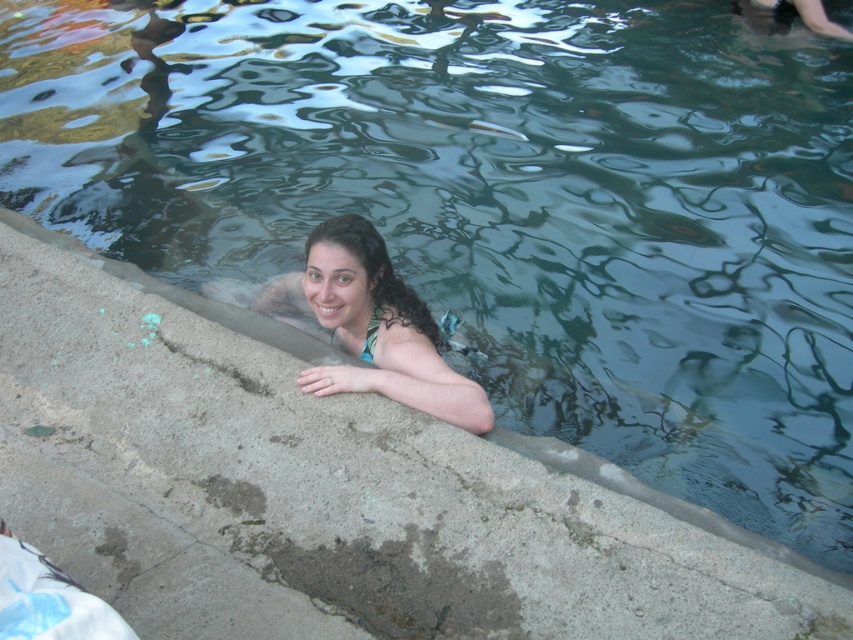
You are standing at the edge of the pool and want to locate two specific points in the water. The first point is at coordinates point (386, 314), and the second is at point (457, 321). Which of these points is closer to you?

Point (386, 314) is closer to the viewer than point (457, 321), so the first point is closer.

You are a photographer trying to capture the best angle of the person in the pool. You notice two points marked in the image at coordinates point (349, 340) and point (370, 340). Which point is closer to the camera and should be focused on to ensure the subject is sharp?

Point (349, 340) is further to the camera than point (370, 340). Therefore, to ensure the subject is sharp, you should focus on point (370, 340) since it is closer to the camera.